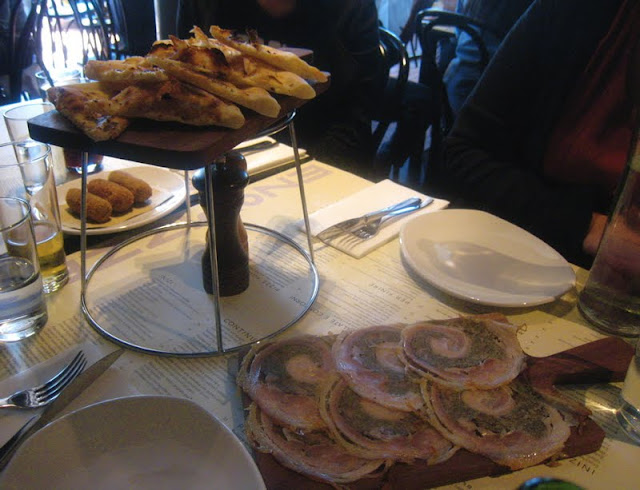
In order to click on glass in this screenshot , I will do `click(22, 313)`, `click(50, 265)`, `click(16, 120)`, `click(41, 82)`, `click(620, 254)`, `click(630, 412)`.